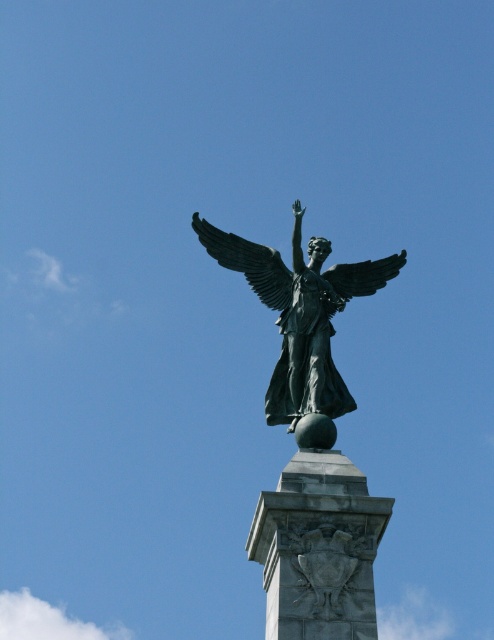
Question: Is bronze statue at center in front of green patina wings at upper center?

Choices:
 (A) no
 (B) yes

Answer: (B)

Question: Is the position of bronze statue at center more distant than that of green patina wings at upper center?

Choices:
 (A) no
 (B) yes

Answer: (A)

Question: Which point is farther to the camera?

Choices:
 (A) (306, 387)
 (B) (374, 284)

Answer: (B)

Question: From the image, what is the correct spatial relationship of green patina wings at upper center in relation to bronze wing at upper center?

Choices:
 (A) above
 (B) below

Answer: (A)

Question: Which of the following is the closest to the observer?

Choices:
 (A) (287, 268)
 (B) (320, 387)

Answer: (B)

Question: Which object is closer to the camera taking this photo?

Choices:
 (A) bronze statue at center
 (B) bronze wing at upper center
 (C) green patina wings at upper center

Answer: (A)